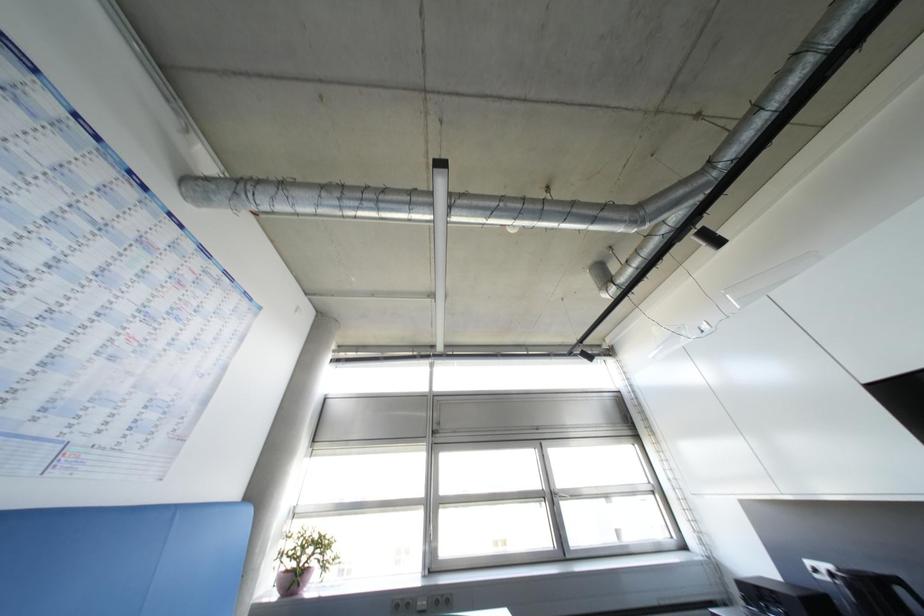
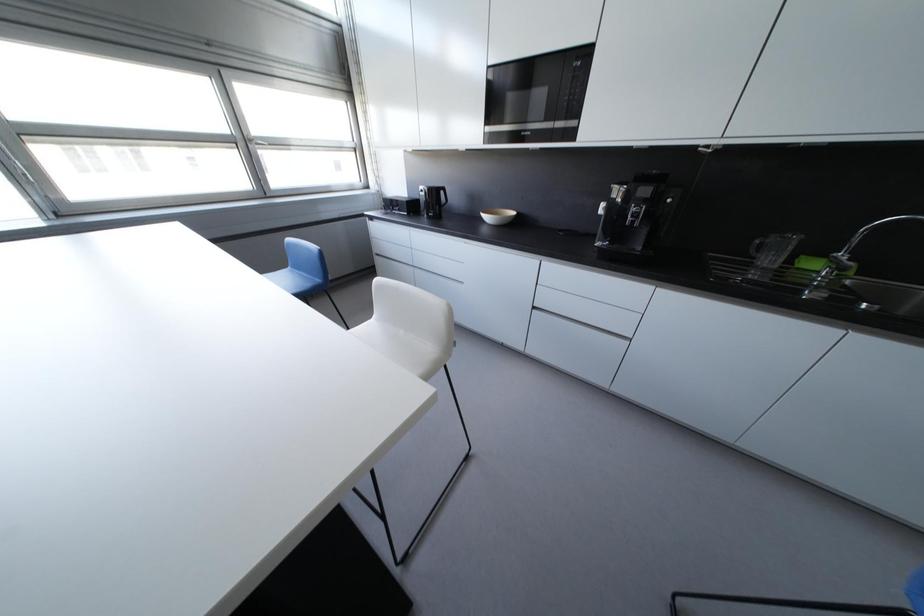
The first image is from the beginning of the video and the second image is from the end. How did the camera likely rotate when shooting the video?

The camera rotated toward right-down.